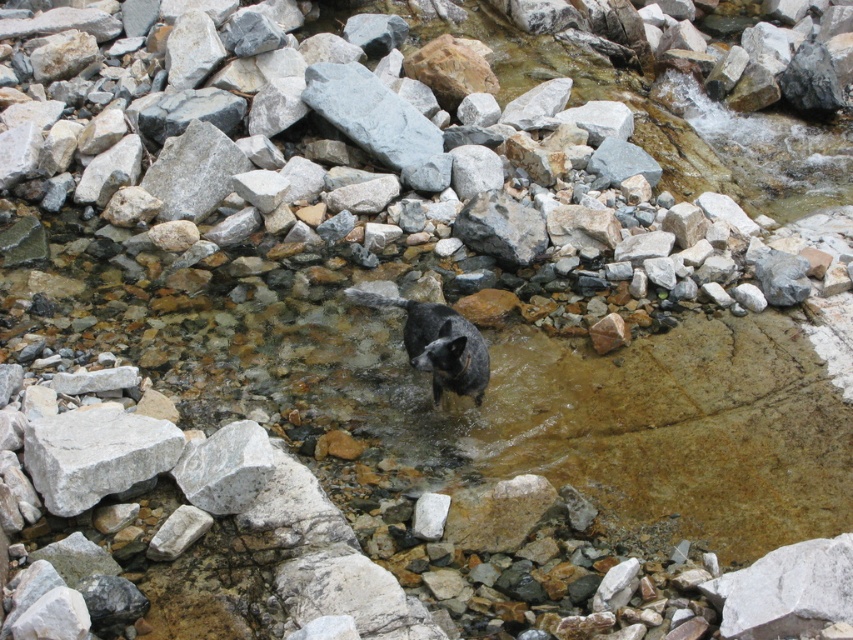
Question: Among these objects, which one is farthest from the camera?

Choices:
 (A) gray smooth rock at center
 (B) gray/rough rock at lower left

Answer: (A)

Question: In this image, where is gray/rough rock at lower left located relative to shiny black fur cat at center?

Choices:
 (A) right
 (B) left

Answer: (B)

Question: Does gray/rough rock at lower left have a smaller size compared to shiny black fur cat at center?

Choices:
 (A) yes
 (B) no

Answer: (A)

Question: Which point is closer to the camera?

Choices:
 (A) (447, 332)
 (B) (341, 116)

Answer: (A)

Question: Which point is farther to the camera?

Choices:
 (A) shiny black fur cat at center
 (B) gray smooth rock at center
 (C) gray/rough rock at lower left

Answer: (B)

Question: Can you confirm if gray/rough rock at lower left is thinner than gray smooth rock at center?

Choices:
 (A) no
 (B) yes

Answer: (B)